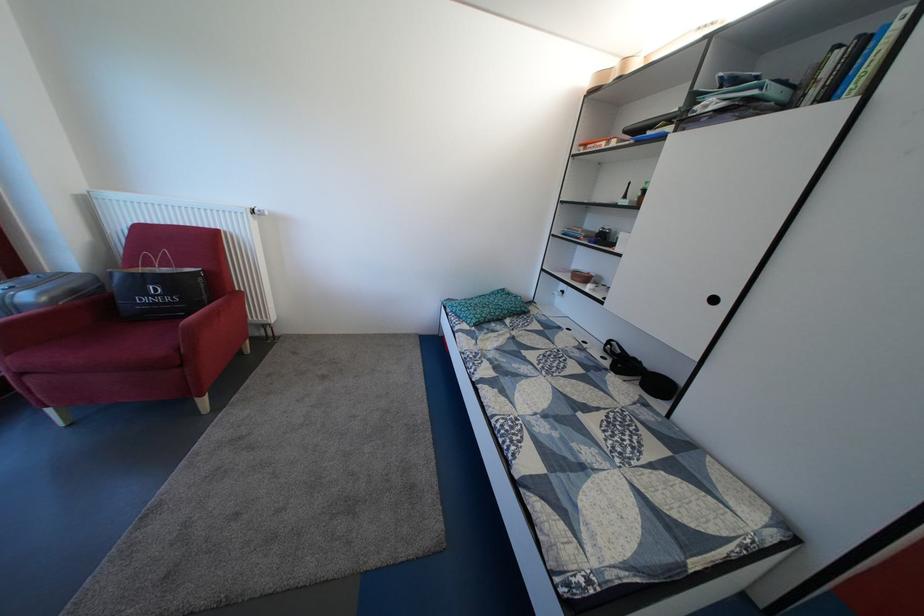
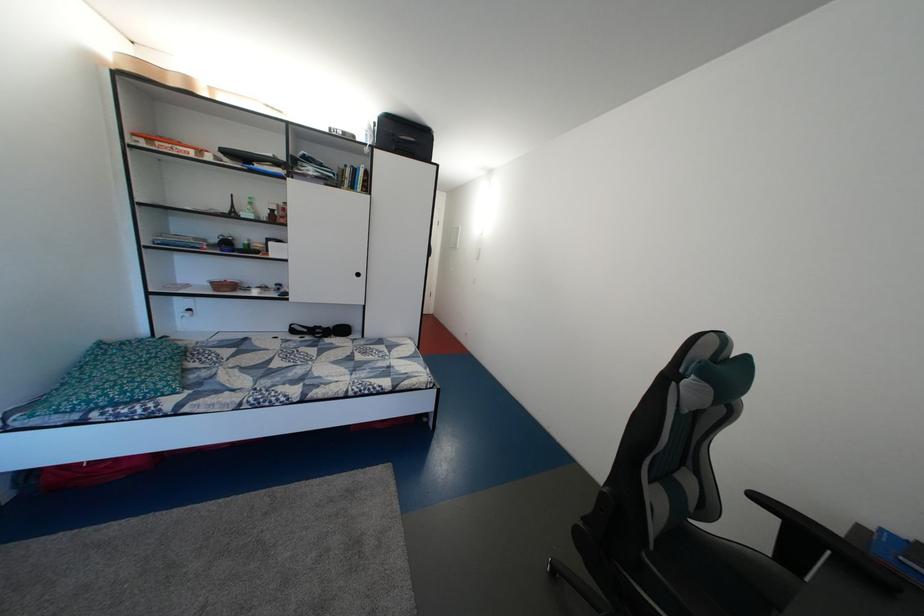
Where in the second image is the point corresponding to [494,314] from the first image?

(160, 376)